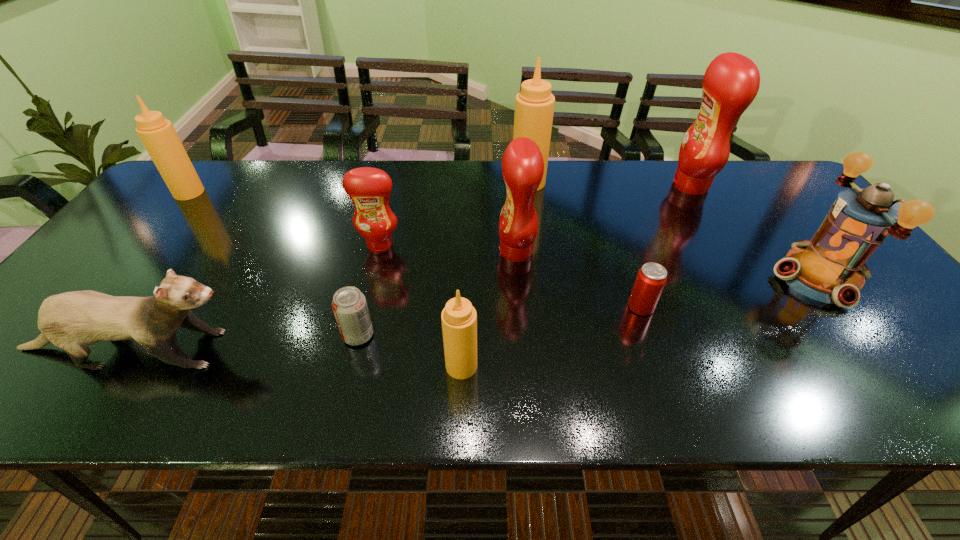
Locate an element on the screen. The image size is (960, 540). object that is at the left edge is located at coordinates (158, 135).

Find the location of a particular element. The height and width of the screenshot is (540, 960). object that is at the right edge is located at coordinates (830, 268).

The image size is (960, 540). What are the coordinates of `object at the far left corner` in the screenshot? It's located at (158, 135).

In the image, there is a desktop. In order to click on vacant space at the far edge in this screenshot , I will do `click(657, 195)`.

The width and height of the screenshot is (960, 540). In the image, there is a desktop. Identify the location of vacant space at the near edge. (107, 374).

Where is `free space at the left edge`? The height and width of the screenshot is (540, 960). free space at the left edge is located at coordinates (107, 267).

At what (x,y) coordinates should I click in order to perform the action: click on vacant space at the right edge of the desktop. Please return your answer as a coordinate pair (x, y). The height and width of the screenshot is (540, 960). Looking at the image, I should click on (859, 300).

Image resolution: width=960 pixels, height=540 pixels. I want to click on free area in between the second red condiment from right to left and the leftmost tan condiment, so click(352, 222).

This screenshot has width=960, height=540. Identify the location of vacant area that lies between the can and the gray soda can. (x=500, y=321).

Identify the location of vacant region between the second red condiment from left to right and the rightmost object. The image size is (960, 540). (667, 264).